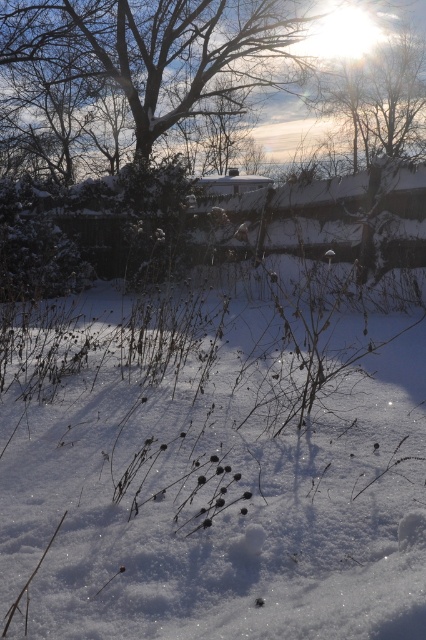
Is white fluffy snow at center thinner than bare branches at upper center?

Indeed, white fluffy snow at center has a lesser width compared to bare branches at upper center.

This screenshot has width=426, height=640. Identify the location of white fluffy snow at center. (201, 481).

Who is more distant from viewer, (230, 340) or (120, 90)?

The point (120, 90) is behind.

Identify the location of white fluffy snow at center. (201, 481).